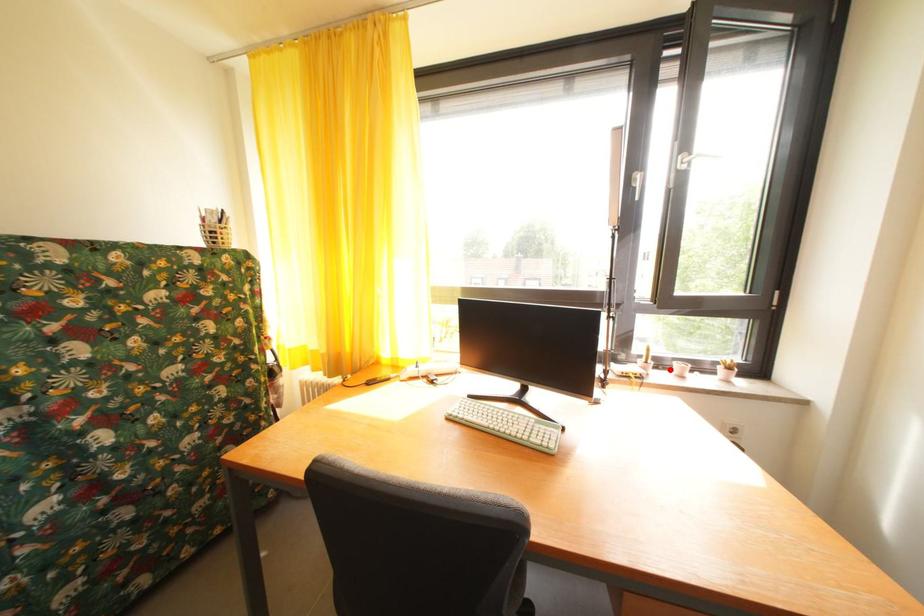
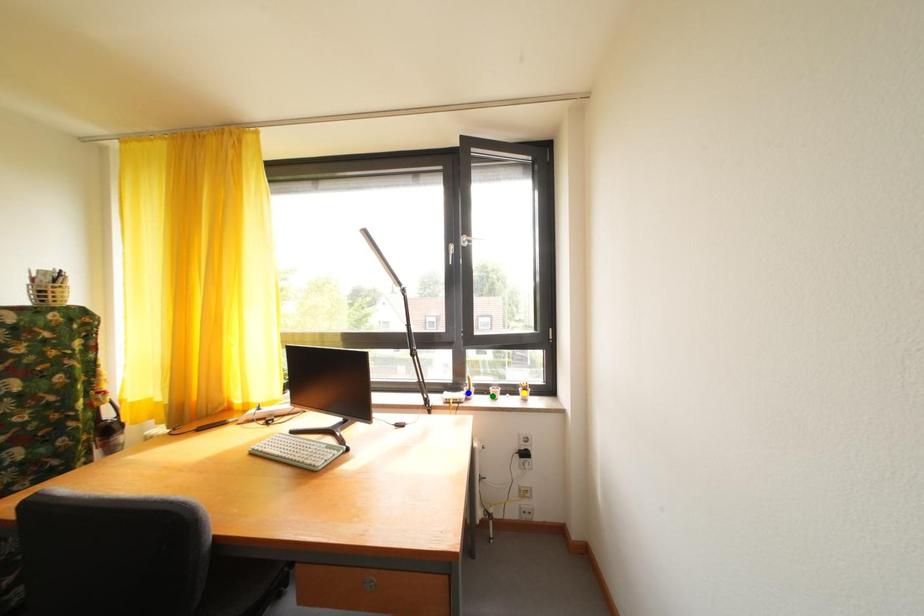
Question: I am providing you with two images of the same scene from different viewpoints. A red point is marked on the first image. You are given multiple points on the second image. Which point in image 2 is actually the same real-world point as the red point in image 1?

Choices:
 (A) blue point
 (B) yellow point
 (C) green point

Answer: (C)